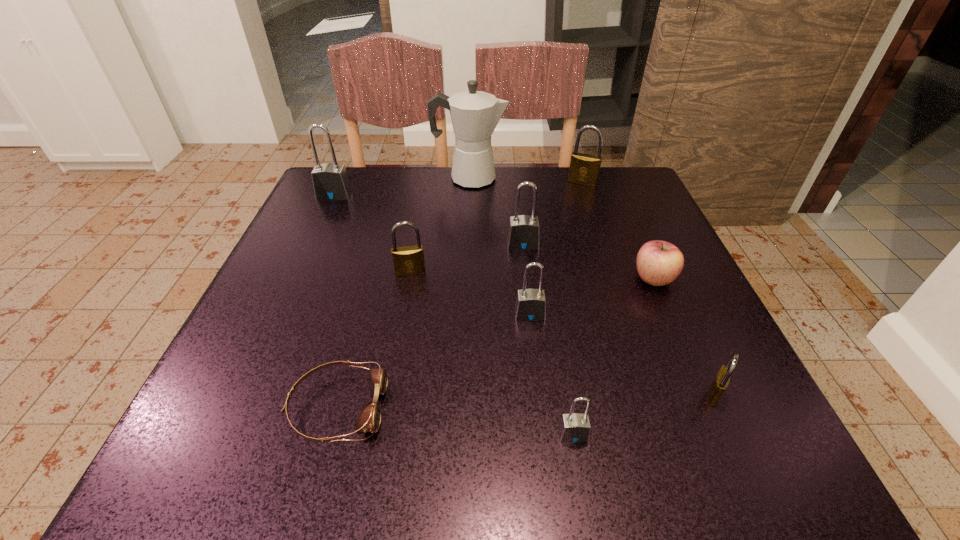
Where is `the leftmost brass padlock`? Image resolution: width=960 pixels, height=540 pixels. the leftmost brass padlock is located at coordinates (409, 260).

Identify the location of the fourth nearest padlock. The width and height of the screenshot is (960, 540). (x=409, y=260).

Find the location of a particular element. apple is located at coordinates (659, 263).

Where is `the nearest padlock`? the nearest padlock is located at coordinates (574, 427).

Locate an element on the screen. Image resolution: width=960 pixels, height=540 pixels. the smallest gray padlock is located at coordinates (574, 427).

Where is `the rightmost padlock`? the rightmost padlock is located at coordinates (722, 379).

Where is `the second nearest padlock`? the second nearest padlock is located at coordinates (722, 379).

Locate an element on the screen. The height and width of the screenshot is (540, 960). goggles is located at coordinates (369, 419).

I want to click on free space located on the left of the coffeepot, so click(378, 178).

Where is `blank area located 0.250m on the shackle of the second tallest object`? blank area located 0.250m on the shackle of the second tallest object is located at coordinates (300, 269).